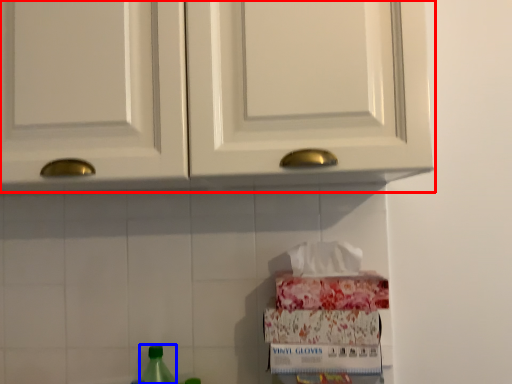
Question: Which of the following is the closest to the observer, cabinetry (highlighted by a red box) or bottle (highlighted by a blue box)?

Choices:
 (A) cabinetry
 (B) bottle

Answer: (A)